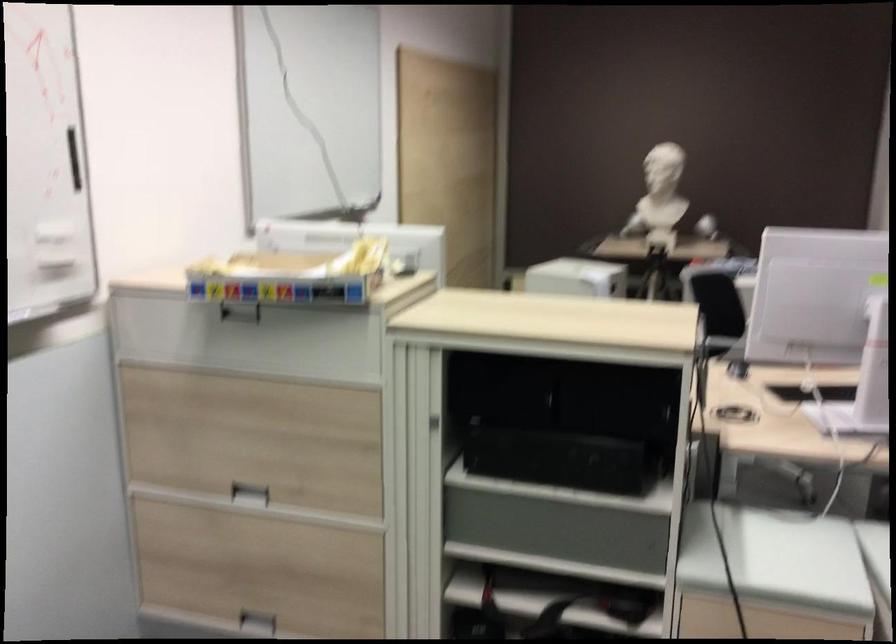
Where would you pull the black box handle? Please return your answer as a coordinate pair (x, y).

(597, 459)